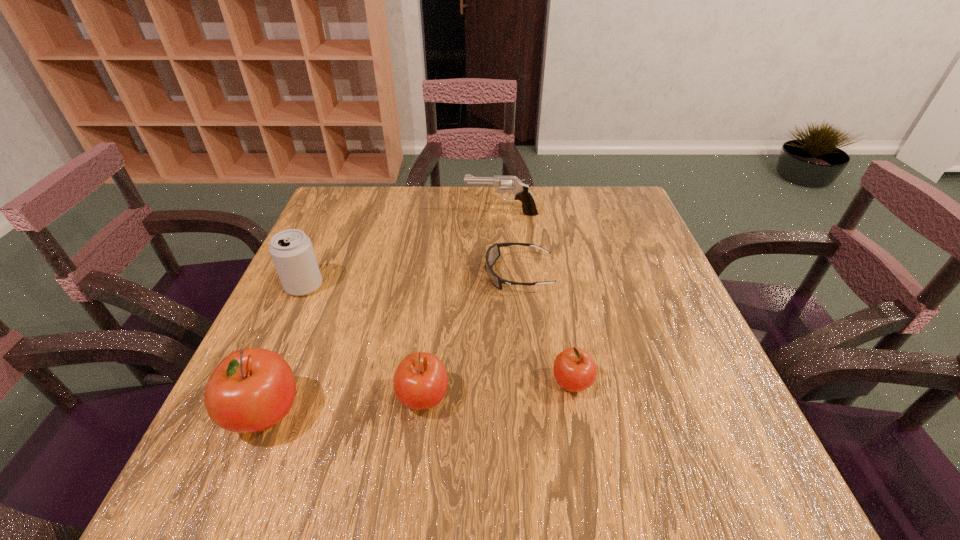
The image size is (960, 540). I want to click on the tallest apple, so click(x=252, y=389).

You are a GUI agent. You are given a task and a screenshot of the screen. Output one action in this format:
    pyautogui.click(x=<x>, y=<y>)
    Task: Click on the leftmost apple
    The image size is (960, 540).
    Given the screenshot: What is the action you would take?
    pyautogui.click(x=252, y=389)

The image size is (960, 540). I want to click on the second shortest apple, so click(x=420, y=382).

What are the coordinates of `the second apple from right to left` in the screenshot? It's located at (420, 382).

You are a GUI agent. You are given a task and a screenshot of the screen. Output one action in this format:
    pyautogui.click(x=<x>, y=<y>)
    Task: Click on the fifth tallest object
    The width and height of the screenshot is (960, 540).
    Given the screenshot: What is the action you would take?
    pyautogui.click(x=574, y=369)

At what (x,y) coordinates should I click in order to perform the action: click on the shortest apple. Please return your answer as a coordinate pair (x, y). Looking at the image, I should click on coord(574,369).

This screenshot has height=540, width=960. In order to click on the farthest object in this screenshot , I will do `click(521, 191)`.

Image resolution: width=960 pixels, height=540 pixels. What are the coordinates of `goggles` in the screenshot? It's located at (493, 253).

This screenshot has height=540, width=960. I want to click on can, so click(x=291, y=250).

The image size is (960, 540). I want to click on vacant space located 0.120m on the left of the second apple from left to right, so click(331, 398).